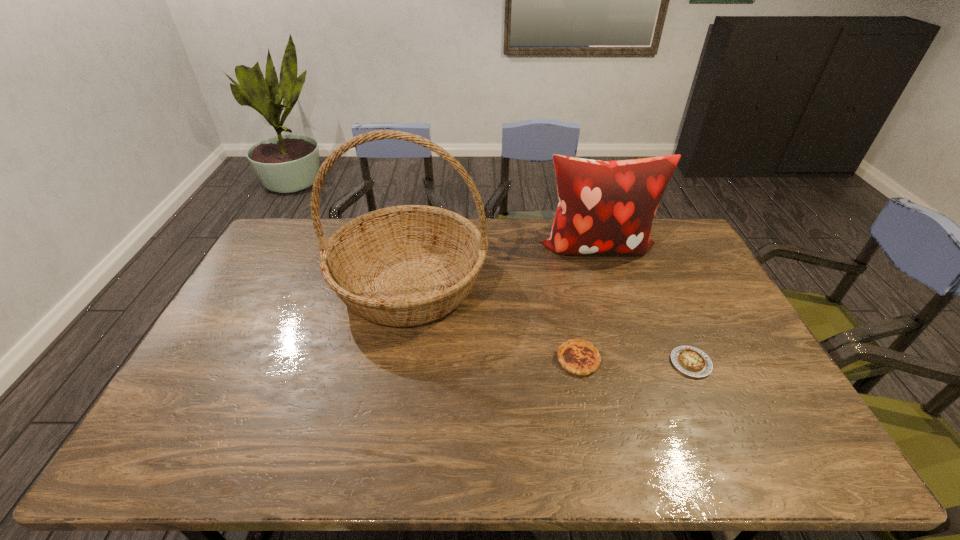
Locate an element on the screen. The image size is (960, 540). the tallest object is located at coordinates (407, 265).

Identify the location of basket. The width and height of the screenshot is (960, 540). (407, 265).

Find the location of a particular element. The image size is (960, 540). cushion is located at coordinates (605, 207).

Locate an element on the screen. The image size is (960, 540). the taller quiche is located at coordinates (577, 356).

At what (x,y) coordinates should I click in order to perform the action: click on the left quiche. Please return your answer as a coordinate pair (x, y). Looking at the image, I should click on (577, 356).

The width and height of the screenshot is (960, 540). Identify the location of the right quiche. (691, 361).

The image size is (960, 540). I want to click on the shorter quiche, so click(x=691, y=361).

Image resolution: width=960 pixels, height=540 pixels. In order to click on vacant space located 0.080m on the back of the tallest object in this screenshot , I will do `click(420, 226)`.

Find the location of `vacant region located on the front-facing side of the second tallest object`. vacant region located on the front-facing side of the second tallest object is located at coordinates (609, 285).

This screenshot has height=540, width=960. In order to click on free space located 0.150m on the left of the left quiche in this screenshot , I will do point(503,359).